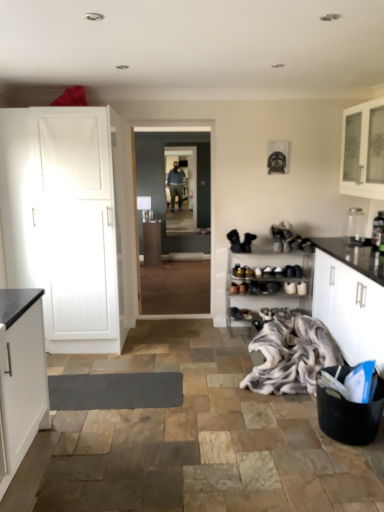
Question: Considering the relative sizes of metallic silver toaster at right, the second appliance in the back-to-front sequence, and white matte cabinet at left in the image provided, is metallic silver toaster at right, the second appliance in the back-to-front sequence, thinner than white matte cabinet at left?

Choices:
 (A) yes
 (B) no

Answer: (A)

Question: Can you confirm if metallic silver toaster at right, the first appliance from the front, is wider than white matte cabinet at left?

Choices:
 (A) yes
 (B) no

Answer: (B)

Question: Is metallic silver toaster at right, the first appliance from the front, to the left of white matte cabinet at left from the viewer's perspective?

Choices:
 (A) yes
 (B) no

Answer: (B)

Question: Can you confirm if metallic silver toaster at right, the first appliance from the front, is positioned to the right of white matte cabinet at left?

Choices:
 (A) yes
 (B) no

Answer: (A)

Question: Is the depth of metallic silver toaster at right, the first appliance from the front, greater than that of white matte cabinet at left?

Choices:
 (A) yes
 (B) no

Answer: (A)

Question: Could you tell me if metallic silver toaster at right, the first appliance from the front, is facing white matte cabinet at left?

Choices:
 (A) no
 (B) yes

Answer: (B)

Question: Can you confirm if clear glass jar at upper right, which is the 2th appliance from front to back, is thinner than white glass cabinet at upper right, which appears as the 3th cabinetry when viewed from the left?

Choices:
 (A) yes
 (B) no

Answer: (A)

Question: Could you tell me if clear glass jar at upper right, which is the 2th appliance from front to back, is facing white glass cabinet at upper right, marked as the 3th cabinetry in a bottom-to-top arrangement?

Choices:
 (A) no
 (B) yes

Answer: (A)

Question: Is clear glass jar at upper right, the 1th appliance from the back, at the left side of white glass cabinet at upper right, marked as the 3th cabinetry in a bottom-to-top arrangement?

Choices:
 (A) yes
 (B) no

Answer: (A)

Question: Considering the relative sizes of clear glass jar at upper right, the 1th appliance from the back, and white glass cabinet at upper right, which is the first cabinetry from top to bottom, in the image provided, is clear glass jar at upper right, the 1th appliance from the back, smaller than white glass cabinet at upper right, which is the first cabinetry from top to bottom,?

Choices:
 (A) yes
 (B) no

Answer: (A)

Question: Would you consider clear glass jar at upper right, which is the 2th appliance from front to back, to be distant from white glass cabinet at upper right, which ranks as the first cabinetry in right-to-left order?

Choices:
 (A) yes
 (B) no

Answer: (B)

Question: Is clear glass jar at upper right, which is the 2th appliance from front to back, wider than white glass cabinet at upper right, which is counted as the 2th cabinetry, starting from the back?

Choices:
 (A) no
 (B) yes

Answer: (A)

Question: Could you tell me if transparent glass door at center is turned towards black woven basket at lower right?

Choices:
 (A) yes
 (B) no

Answer: (A)